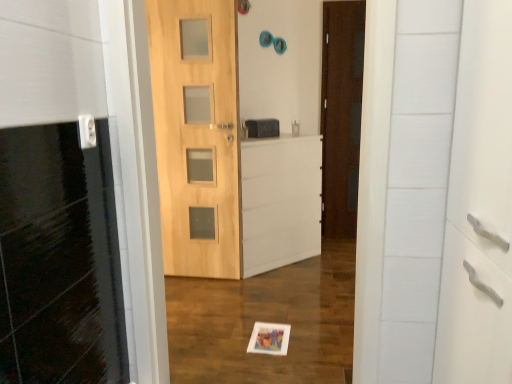
Question: Which direction should I rotate to look at dark brown wood door at center, which ranks as the first door in back-to-front order?

Choices:
 (A) left
 (B) right

Answer: (B)

Question: From the image's perspective, is white plastic electric outlet at upper left beneath dark brown wood door at center, the second door in the front-to-back sequence?

Choices:
 (A) no
 (B) yes

Answer: (B)

Question: From a real-world perspective, is white plastic electric outlet at upper left located beneath dark brown wood door at center, which ranks as the first door in back-to-front order?

Choices:
 (A) yes
 (B) no

Answer: (B)

Question: Is white plastic electric outlet at upper left looking in the opposite direction of dark brown wood door at center, which ranks as the first door in back-to-front order?

Choices:
 (A) yes
 (B) no

Answer: (B)

Question: Considering the relative sizes of white plastic electric outlet at upper left and dark brown wood door at center, arranged as the 2th door when viewed from the left, in the image provided, is white plastic electric outlet at upper left smaller than dark brown wood door at center, arranged as the 2th door when viewed from the left,?

Choices:
 (A) yes
 (B) no

Answer: (A)

Question: From a real-world perspective, is white plastic electric outlet at upper left positioned over dark brown wood door at center, arranged as the 2th door when viewed from the left, based on gravity?

Choices:
 (A) yes
 (B) no

Answer: (A)

Question: Can we say white plastic electric outlet at upper left lies outside dark brown wood door at center, arranged as the 2th door when viewed from the left?

Choices:
 (A) no
 (B) yes

Answer: (B)

Question: Is matte black medicine cabinet at center thinner than dark brown wood door at center, which ranks as the first door in back-to-front order?

Choices:
 (A) yes
 (B) no

Answer: (B)

Question: From a real-world perspective, is matte black medicine cabinet at center located higher than dark brown wood door at center, acting as the first door starting from the right?

Choices:
 (A) yes
 (B) no

Answer: (A)

Question: From the image's perspective, is matte black medicine cabinet at center below dark brown wood door at center, which ranks as the first door in back-to-front order?

Choices:
 (A) yes
 (B) no

Answer: (A)

Question: Considering the relative sizes of matte black medicine cabinet at center and dark brown wood door at center, the second door in the front-to-back sequence, in the image provided, is matte black medicine cabinet at center shorter than dark brown wood door at center, the second door in the front-to-back sequence,?

Choices:
 (A) no
 (B) yes

Answer: (B)

Question: Can you see matte black medicine cabinet at center touching dark brown wood door at center, which ranks as the first door in back-to-front order?

Choices:
 (A) no
 (B) yes

Answer: (A)

Question: Considering the relative positions of matte black medicine cabinet at center and dark brown wood door at center, acting as the first door starting from the right, in the image provided, is matte black medicine cabinet at center to the right of dark brown wood door at center, acting as the first door starting from the right, from the viewer's perspective?

Choices:
 (A) yes
 (B) no

Answer: (B)

Question: Is the position of natural wood door at center, acting as the 1th door starting from the left, more distant than that of matte black medicine cabinet at center?

Choices:
 (A) no
 (B) yes

Answer: (A)